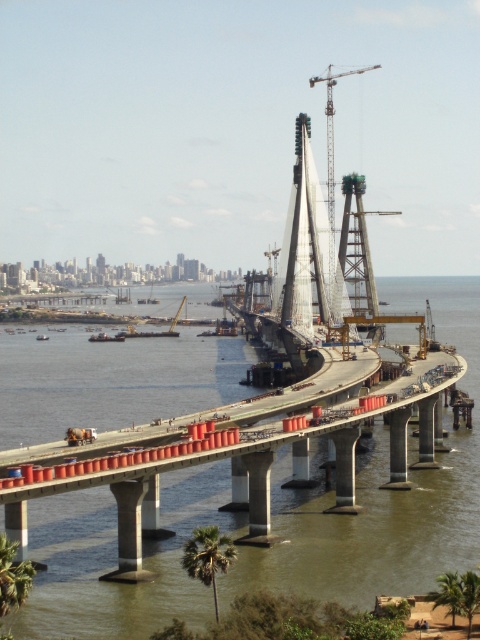
Question: Based on their relative distances, which object is nearer to the green leafy palm tree at lower left?

Choices:
 (A) concrete bridge at center
 (B) metallic gray crane at center

Answer: (A)

Question: In this image, where is green leafy palm tree at lower center located relative to green leafy palm tree at lower left?

Choices:
 (A) below
 (B) above

Answer: (A)

Question: Which of the following is the farthest from the observer?

Choices:
 (A) metallic gray crane at center
 (B) green leafy palm tree at lower left
 (C) concrete bridge at center
 (D) green leafy palm tree at lower center

Answer: (A)

Question: Is green leafy palm tree at lower center to the right of green leafy palm tree at lower left from the viewer's perspective?

Choices:
 (A) no
 (B) yes

Answer: (B)

Question: Which point is closer to the camera?

Choices:
 (A) (7, 577)
 (B) (328, 266)
 (C) (219, 536)
 (D) (472, 464)

Answer: (A)

Question: Does green leafy palm tree at lower center come behind metallic gray crane at center?

Choices:
 (A) no
 (B) yes

Answer: (A)